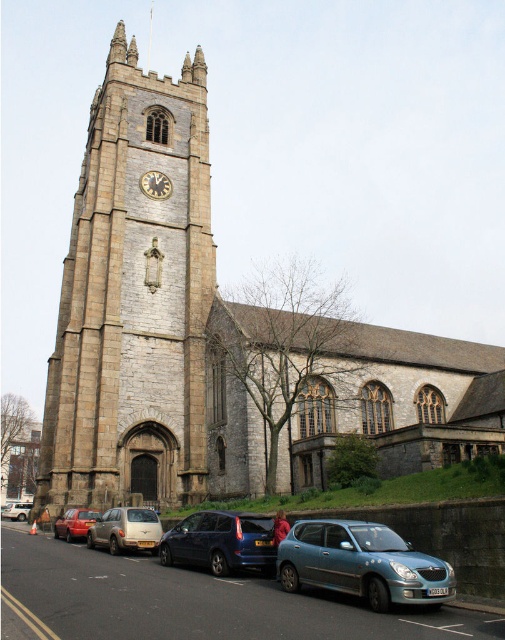
Question: Which point appears farthest from the camera in this image?

Choices:
 (A) (145, 182)
 (B) (101, 244)
 (C) (129, 525)
 (D) (439, 561)

Answer: (A)

Question: Which object is the farthest from the metallic red car at lower left?

Choices:
 (A) stone clock tower at center
 (B) silver metallic hatchback at center
 (C) metallic blue van at center

Answer: (A)

Question: Does stone clock tower at center have a greater width compared to silver metallic hatchback at center?

Choices:
 (A) yes
 (B) no

Answer: (A)

Question: Does metallic blue van at center come behind silver metallic hatchback at center?

Choices:
 (A) no
 (B) yes

Answer: (A)

Question: Which object is closer to the camera taking this photo?

Choices:
 (A) metallic red car at lower left
 (B) metallic blue van at center

Answer: (B)

Question: Can you confirm if stone clock tower at center is positioned to the left of metallic blue hatchback at lower center?

Choices:
 (A) no
 (B) yes

Answer: (B)